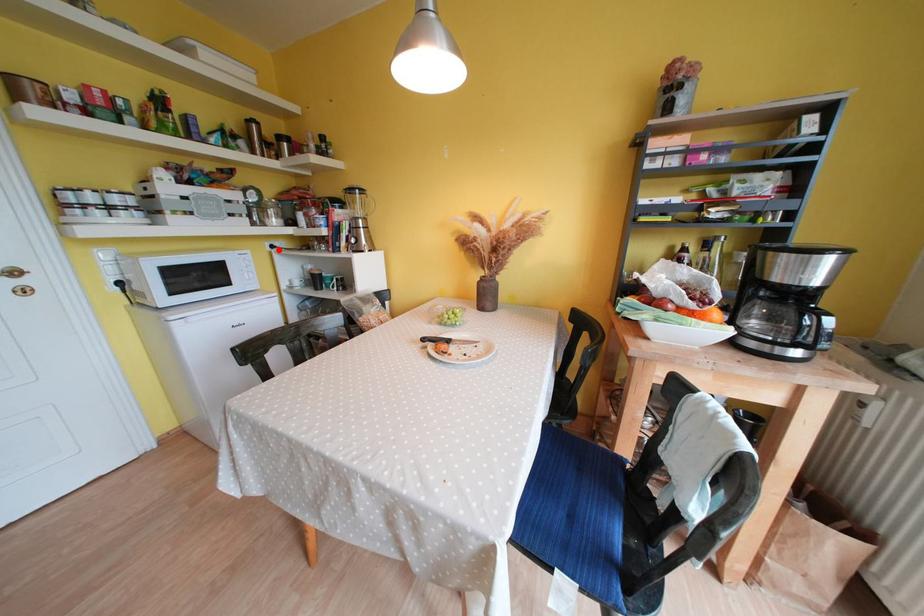
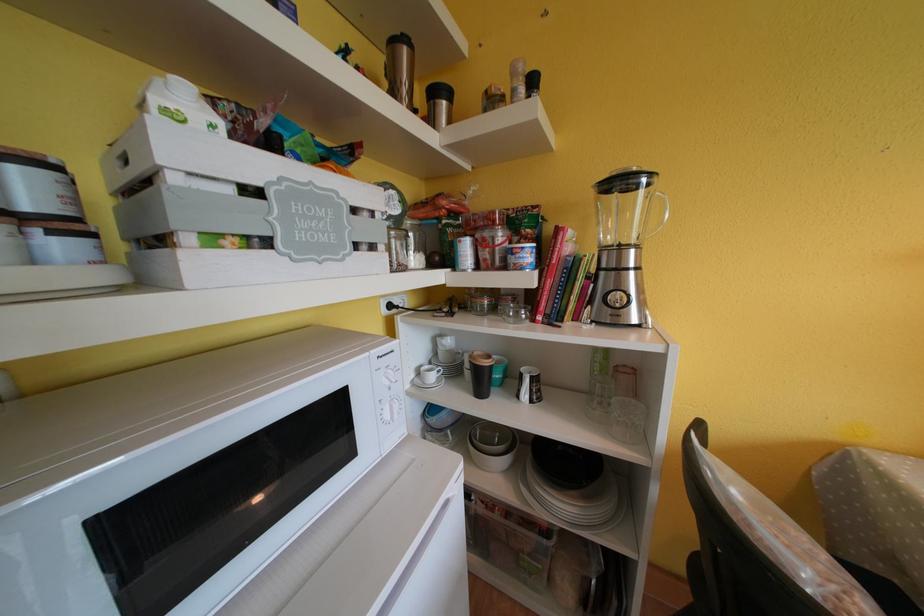
Where in the second image is the point corresponding to the highlighted location from the first image?

(396, 310)